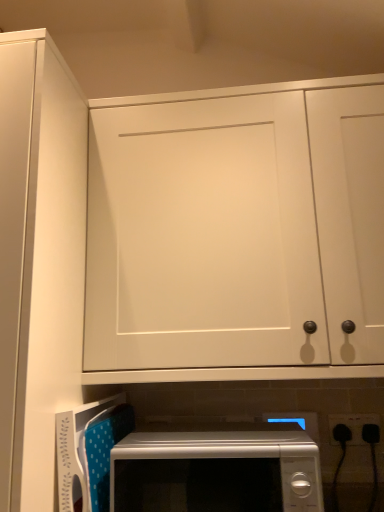
Question: Considering the relative positions of white matte cabinet door at upper center, positioned as the second door in left-to-right order, and white plastic microwave at lower center in the image provided, is white matte cabinet door at upper center, positioned as the second door in left-to-right order, to the left or to the right of white plastic microwave at lower center?

Choices:
 (A) left
 (B) right

Answer: (B)

Question: Considering the positions of white matte cabinet door at upper center, which appears as the first door when viewed from the right, and white plastic microwave at lower center in the image, is white matte cabinet door at upper center, which appears as the first door when viewed from the right, taller or shorter than white plastic microwave at lower center?

Choices:
 (A) tall
 (B) short

Answer: (A)

Question: Considering the real-world distances, which object is farthest from the black plastic electrical outlet at lower right?

Choices:
 (A) white matte cabinet door at upper center, positioned as the second door in left-to-right order
 (B) white plastic microwave at lower center
 (C) white glossy microwave at lower center
 (D) white matte cabinet door at upper left, arranged as the 2th door when viewed from the right

Answer: (D)

Question: Which is nearer to the white glossy microwave at lower center?

Choices:
 (A) white matte cabinet door at upper left, arranged as the 2th door when viewed from the right
 (B) black plastic electrical outlet at lower right
 (C) white matte cabinet door at upper center, which appears as the first door when viewed from the right
 (D) white plastic microwave at lower center

Answer: (D)